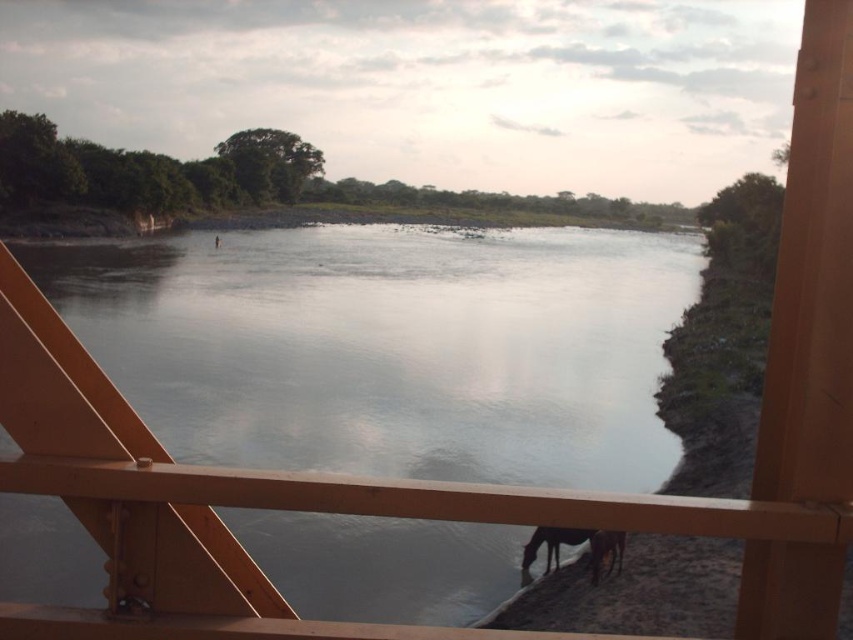
What do you see at coordinates (389, 348) in the screenshot? I see `smooth water at center` at bounding box center [389, 348].

Does smooth water at center have a smaller size compared to dark brown fur horse at lower right?

No, smooth water at center is not smaller than dark brown fur horse at lower right.

Where is `smooth water at center`? The width and height of the screenshot is (853, 640). smooth water at center is located at coordinates (389, 348).

The image size is (853, 640). I want to click on smooth water at center, so click(389, 348).

Who is shorter, smooth water at center or white glossy horse at lower right?

white glossy horse at lower right

Can you confirm if smooth water at center is wider than white glossy horse at lower right?

Correct, the width of smooth water at center exceeds that of white glossy horse at lower right.

This screenshot has height=640, width=853. I want to click on smooth water at center, so [x=389, y=348].

Between dark brown fur horse at lower right and white glossy horse at lower right, which one appears on the left side from the viewer's perspective?

dark brown fur horse at lower right is more to the left.

Which is behind, point (547, 541) or point (614, 547)?

Positioned behind is point (547, 541).

Who is more forward, (x=526, y=566) or (x=613, y=561)?

Point (x=613, y=561) is in front.

Locate an element on the screen. dark brown fur horse at lower right is located at coordinates (552, 544).